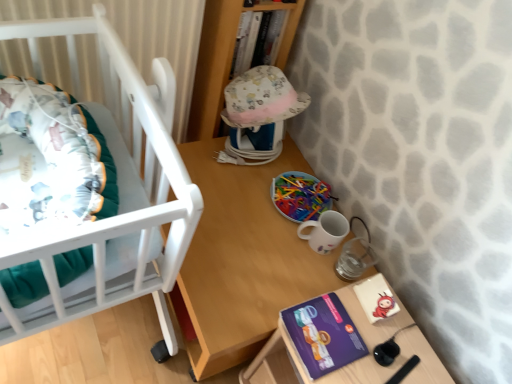
Locate an element on the screen. The height and width of the screenshot is (384, 512). vacant position to the left of white glossy mug at lower right is located at coordinates (257, 219).